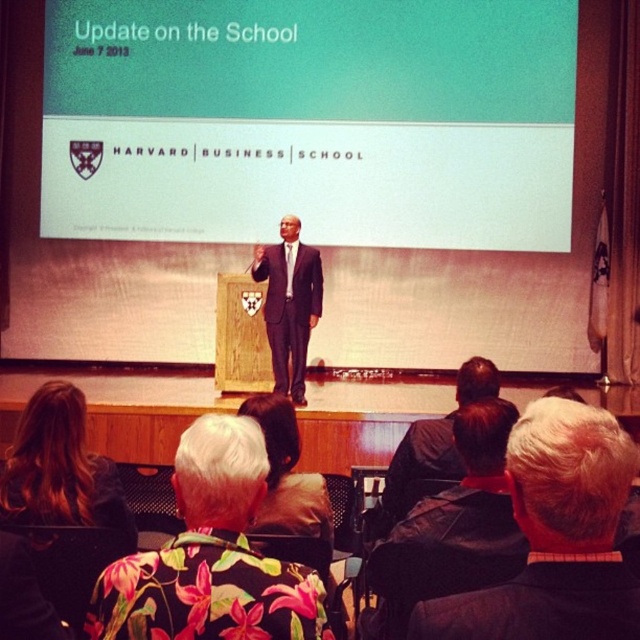
Is point (420, 605) farther from camera compared to point (29, 460)?

No, it is not.

Between point (554, 534) and point (52, 451), which one is positioned in front?

Positioned in front is point (554, 534).

Locate an element on the screen. gray hair at upper right is located at coordinates (556, 536).

Is floral shirt at lower left smaller than black suit at center?

Indeed, floral shirt at lower left has a smaller size compared to black suit at center.

Is the position of floral shirt at lower left more distant than that of black suit at center?

No, it is in front of black suit at center.

What do you see at coordinates (211, 556) in the screenshot?
I see `floral shirt at lower left` at bounding box center [211, 556].

In order to click on floral shirt at lower left in this screenshot , I will do `click(211, 556)`.

Does black leather jacket at lower right have a lesser width compared to floral fabric shirt at lower left?

Yes.

Does black leather jacket at lower right appear under floral fabric shirt at lower left?

Yes, black leather jacket at lower right is below floral fabric shirt at lower left.

The image size is (640, 640). Find the location of `black leather jacket at lower right`. black leather jacket at lower right is located at coordinates (451, 529).